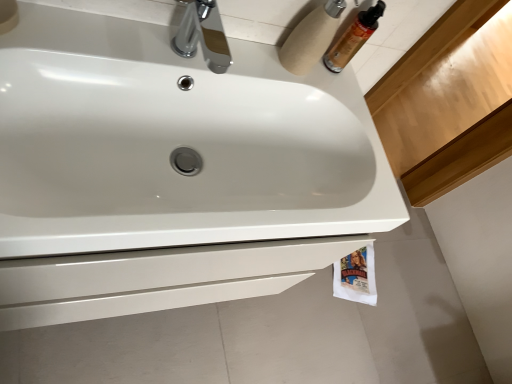
Where is `vacant area that is in front of white paper towel at lower right, acting as the first toilet paper starting from the back`? This screenshot has width=512, height=384. vacant area that is in front of white paper towel at lower right, acting as the first toilet paper starting from the back is located at coordinates (333, 311).